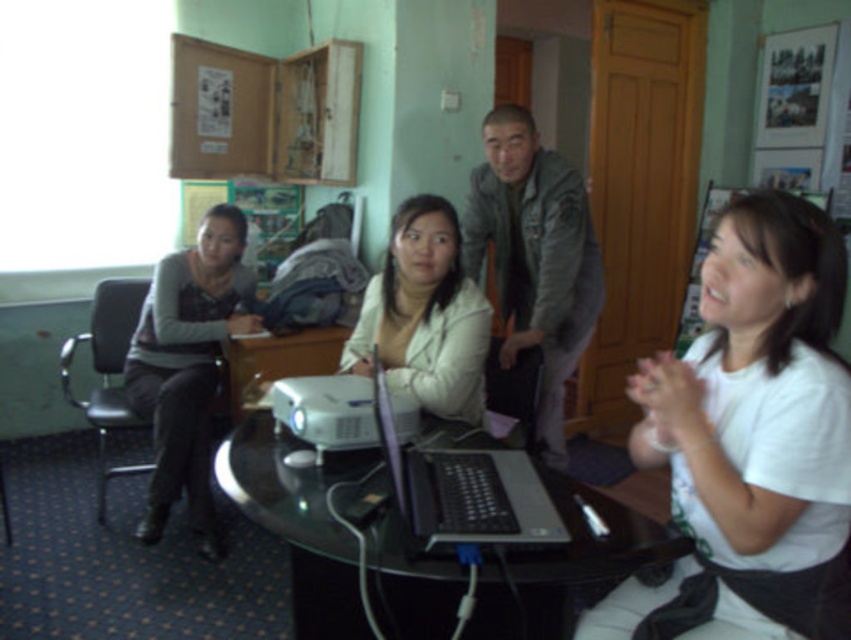
Question: Which point is closer to the camera taking this photo?

Choices:
 (A) (518, 468)
 (B) (774, 570)
 (C) (224, 488)

Answer: (B)

Question: Is black glass table at center positioned behind matte gray sweater at left?

Choices:
 (A) no
 (B) yes

Answer: (A)

Question: Which point is farther to the camera?

Choices:
 (A) gray fabric jacket at upper center
 (B) silver/black plastic laptop at center
 (C) white matte jacket at center

Answer: (A)

Question: Is black glass table at center thinner than silver/black plastic laptop at center?

Choices:
 (A) no
 (B) yes

Answer: (A)

Question: Does matte gray sweater at left have a greater width compared to silver/black plastic laptop at center?

Choices:
 (A) yes
 (B) no

Answer: (A)

Question: Which object is the closest to the matte gray sweater at left?

Choices:
 (A) black glass table at center
 (B) gray fabric jacket at upper center
 (C) white matte shirt at lower right

Answer: (B)